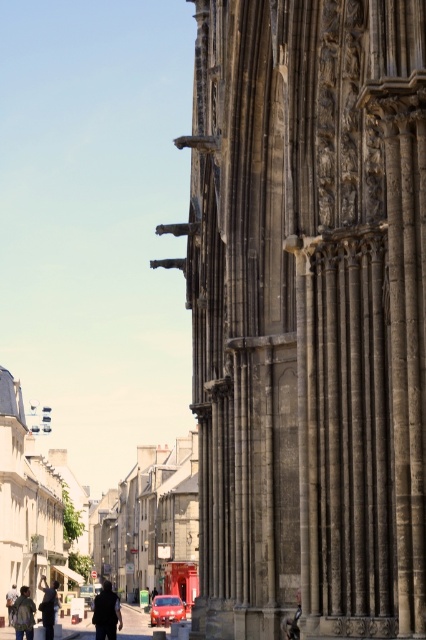
You are standing in front of the historic stone building and see the dark stone columns at right and the dark gray jacket at lower left. Which object is positioned to the right of the other?

The dark stone columns at right are to the right of the dark gray jacket at lower left.

You are a visitor standing in front of the historic stone building. You notice the dark stone columns at right and the dark gray jacket at lower left. Which object takes up more space in the scene?

The dark stone columns at right is larger in size than the dark gray jacket at lower left, so the dark stone columns at right takes up more space in the scene.